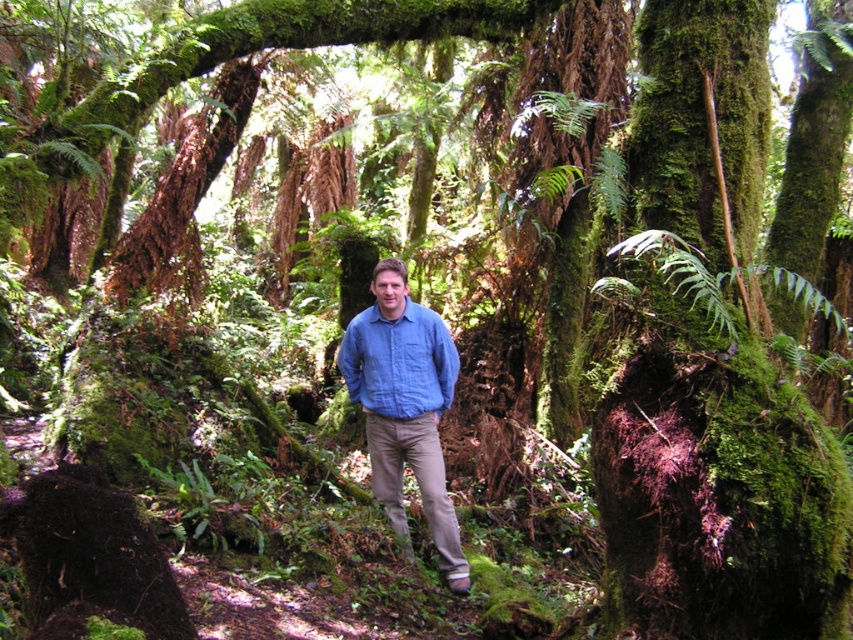
Does blue cotton shirt at center lie behind matte blue shirt at center?

No, blue cotton shirt at center is in front of matte blue shirt at center.

Is blue cotton shirt at center shorter than matte blue shirt at center?

No, blue cotton shirt at center is not shorter than matte blue shirt at center.

Does point (426, 368) come behind point (350, 380)?

That is False.

Identify the location of blue cotton shirt at center. (405, 406).